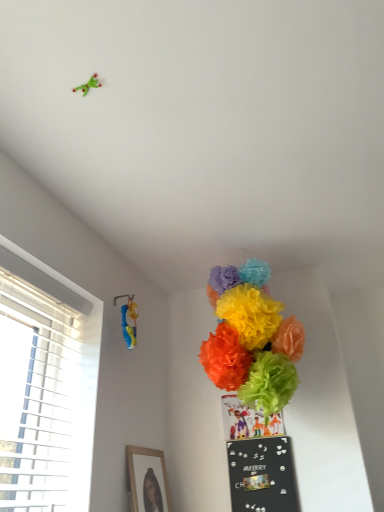
Question: In the image, is blue plastic toy at upper left positioned in front of or behind bright tissue paper pom-poms at center?

Choices:
 (A) behind
 (B) front

Answer: (A)

Question: Considering the positions of point (130, 301) and point (251, 266), is point (130, 301) closer or farther from the camera than point (251, 266)?

Choices:
 (A) closer
 (B) farther

Answer: (B)

Question: Considering the real-world distances, which object is closest to the bright tissue paper pom-poms at center?

Choices:
 (A) black matte bulletin board at lower center
 (B) blue plastic toy at upper left
 (C) wooden framed picture at lower left

Answer: (A)

Question: Which of these objects is positioned farthest from the black matte bulletin board at lower center?

Choices:
 (A) wooden framed picture at lower left
 (B) bright tissue paper pom-poms at center
 (C) blue plastic toy at upper left

Answer: (C)